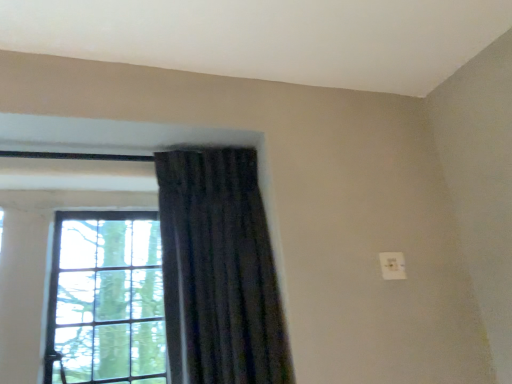
Question: Relative to clear glass window at left, is dark fabric curtain at center in front or behind?

Choices:
 (A) front
 (B) behind

Answer: (A)

Question: Is point (231, 208) positioned closer to the camera than point (148, 258)?

Choices:
 (A) closer
 (B) farther

Answer: (A)

Question: From the image's perspective, is dark fabric curtain at center located above or below clear glass window at left?

Choices:
 (A) below
 (B) above

Answer: (B)

Question: Choose the correct answer: Is clear glass window at left inside dark fabric curtain at center or outside it?

Choices:
 (A) inside
 (B) outside

Answer: (B)

Question: Is point (10, 259) closer or farther from the camera than point (243, 226)?

Choices:
 (A) closer
 (B) farther

Answer: (A)

Question: Considering the relative positions of clear glass window at left and dark fabric curtain at center in the image provided, is clear glass window at left to the left or to the right of dark fabric curtain at center?

Choices:
 (A) left
 (B) right

Answer: (A)

Question: In terms of size, does clear glass window at left appear bigger or smaller than dark fabric curtain at center?

Choices:
 (A) big
 (B) small

Answer: (B)